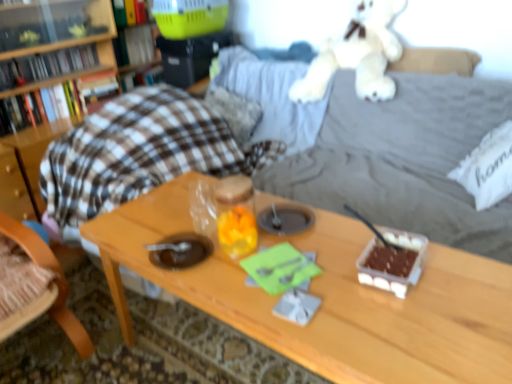
I want to click on vacant area that is situated to the right of translucent plastic container with chocolate at right, so click(x=463, y=271).